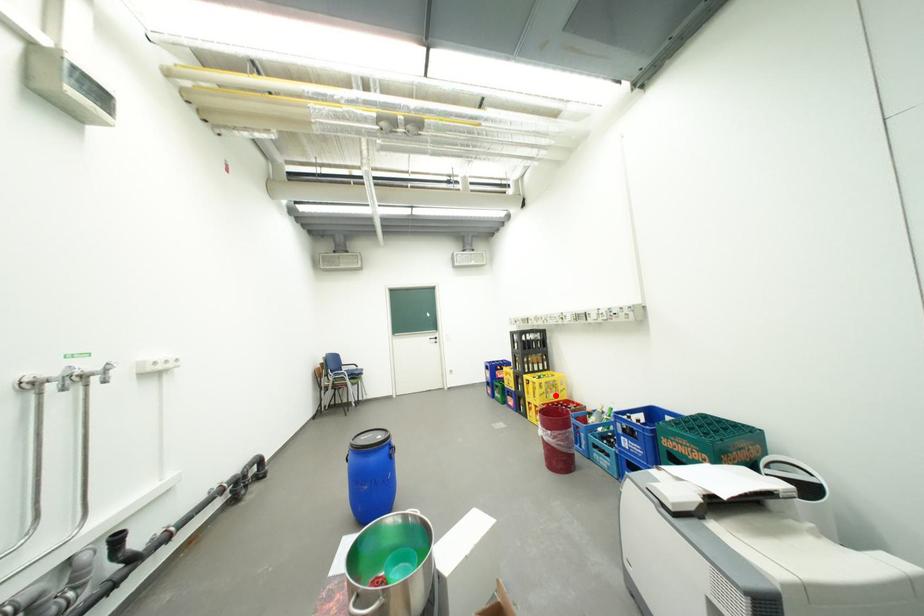
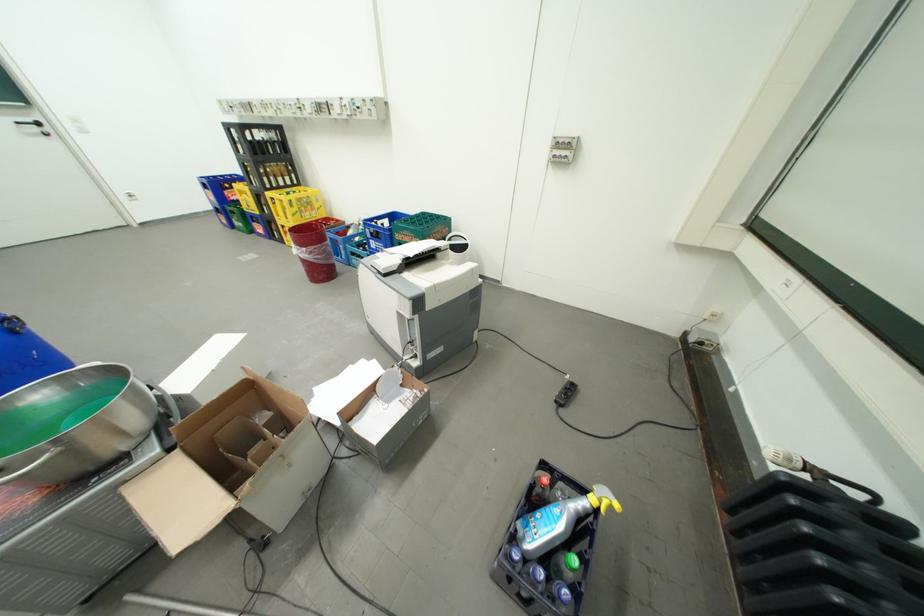
Question: I am providing you with two images of the same scene from different viewpoints. A red point is shown in image1. For the corresponding object point in image2, is it positioned nearer or farther from the camera?

Choices:
 (A) Nearer
 (B) Farther

Answer: (A)